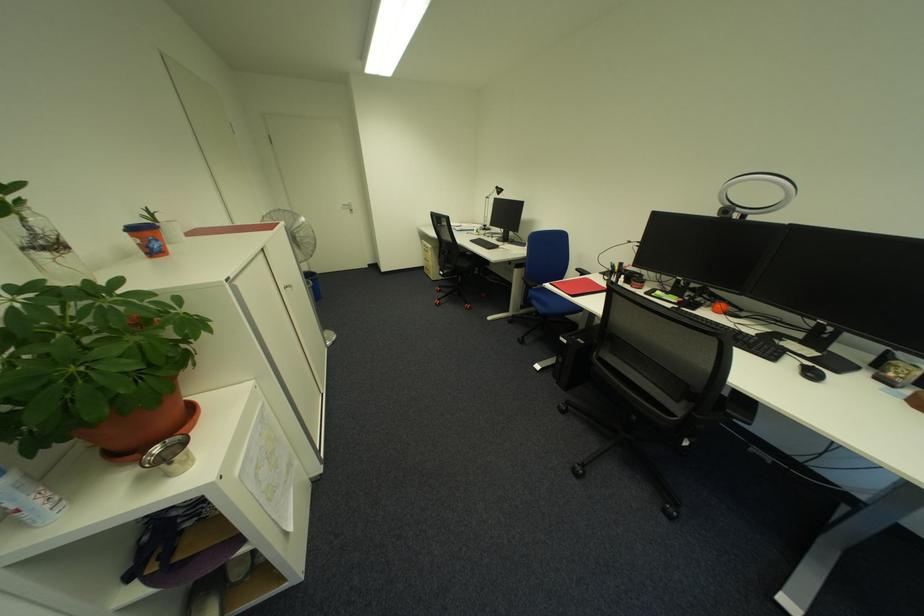
I want to click on orange stress ball, so click(719, 307).